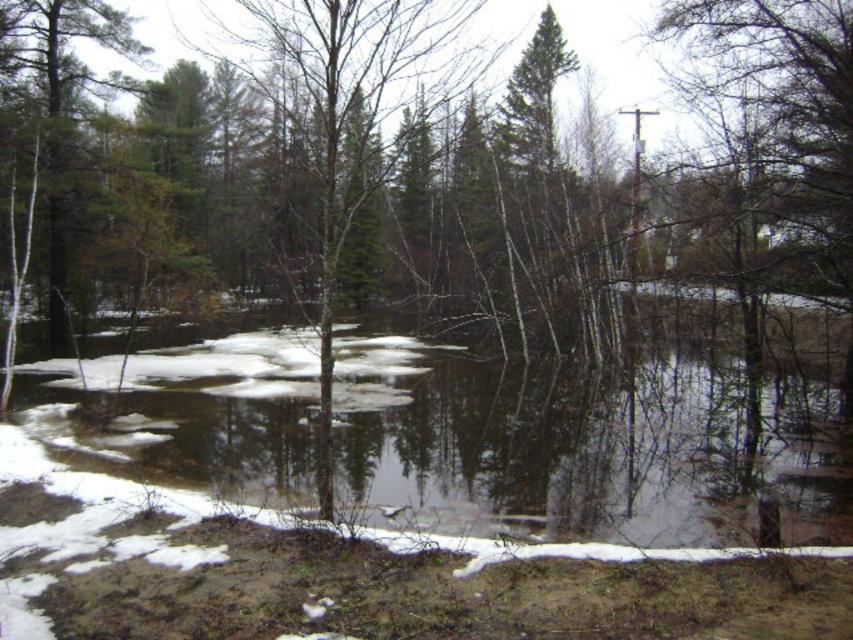
Question: Can you confirm if brown/reflective water at center is smaller than green matte tree at center?

Choices:
 (A) no
 (B) yes

Answer: (B)

Question: Which object appears closest to the camera in this image?

Choices:
 (A) brown/reflective water at center
 (B) green matte tree at center

Answer: (B)

Question: Is brown/reflective water at center bigger than green matte tree at center?

Choices:
 (A) yes
 (B) no

Answer: (B)

Question: In this image, where is brown/reflective water at center located relative to green matte tree at center?

Choices:
 (A) above
 (B) below

Answer: (B)